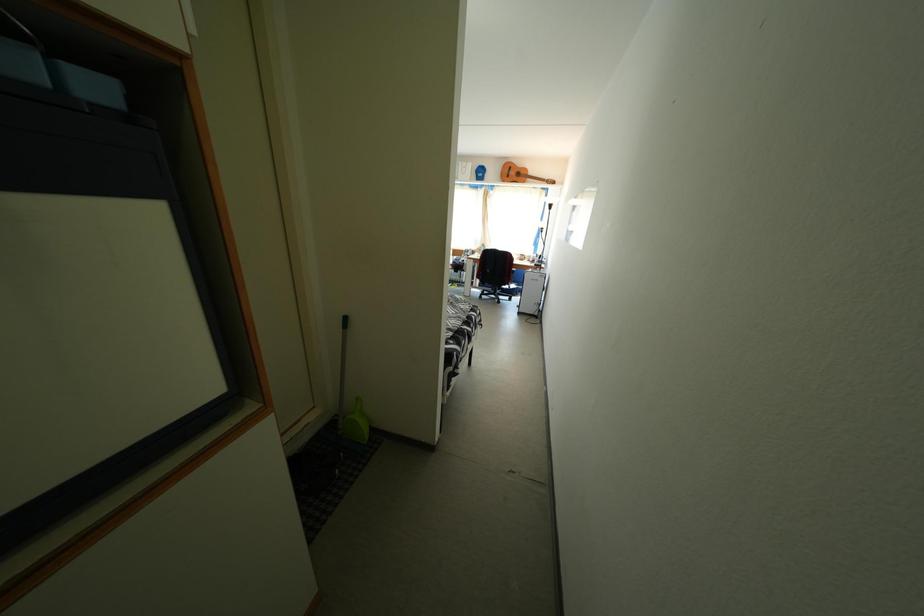
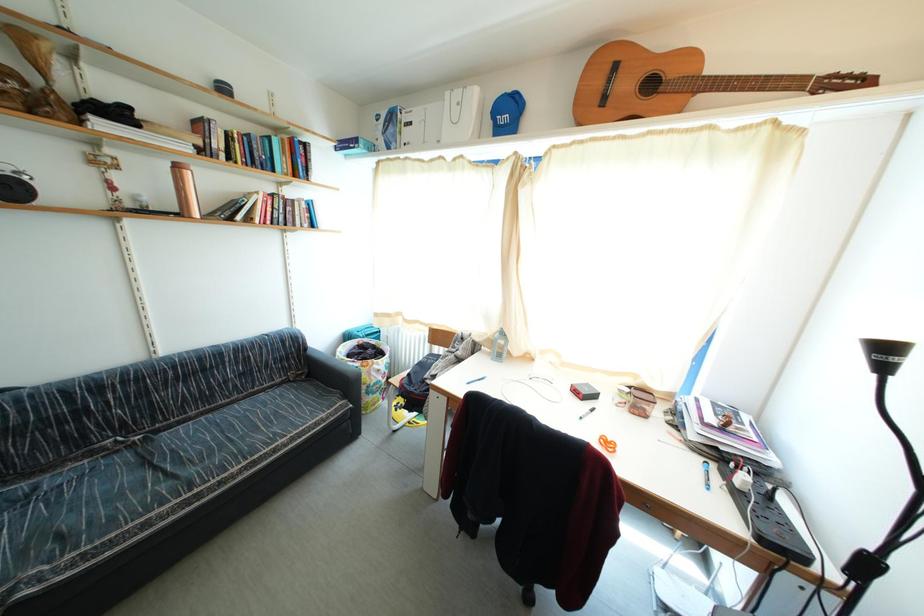
Question: The images are taken continuously from a first-person perspective. In which direction are you moving?

Choices:
 (A) Left
 (B) Right
 (C) Forward
 (D) Backward

Answer: (C)